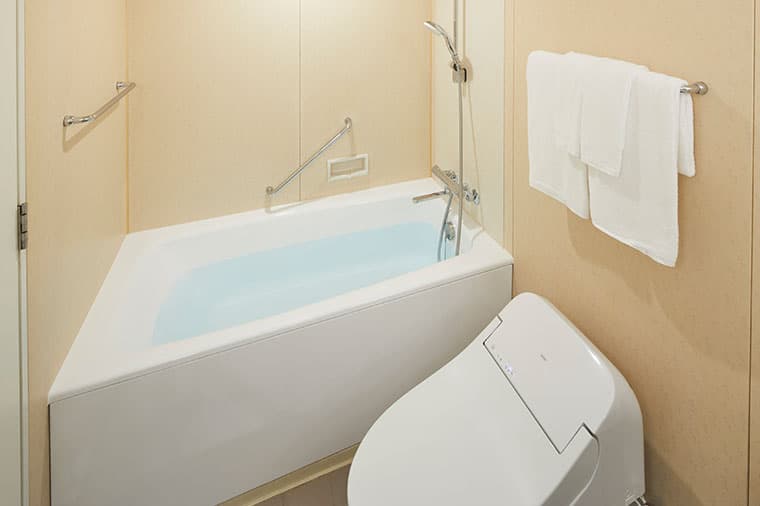
The image size is (760, 506). What are the coordinates of `toilet lid` in the screenshot? It's located at (470, 439).